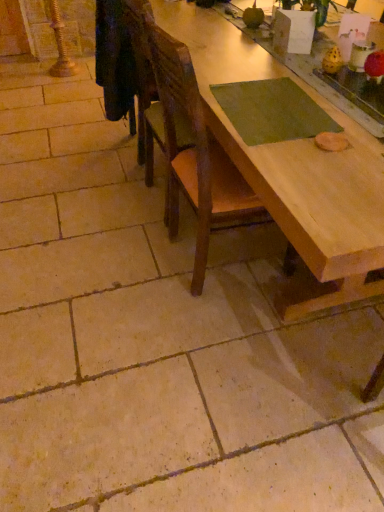
Question: Is the surface of wooden chair at center in direct contact with natural wood table at center?

Choices:
 (A) yes
 (B) no

Answer: (B)

Question: Could you tell me if wooden chair at center is turned towards natural wood table at center?

Choices:
 (A) no
 (B) yes

Answer: (B)

Question: From a real-world perspective, does wooden chair at center stand above natural wood table at center?

Choices:
 (A) yes
 (B) no

Answer: (A)

Question: Is wooden chair at center behind natural wood table at center?

Choices:
 (A) yes
 (B) no

Answer: (A)

Question: Can you confirm if wooden chair at center is taller than natural wood table at center?

Choices:
 (A) yes
 (B) no

Answer: (A)

Question: Is wooden chair at center bigger than natural wood table at center?

Choices:
 (A) yes
 (B) no

Answer: (B)

Question: Is natural wood table at center positioned with its back to wooden chair at center?

Choices:
 (A) yes
 (B) no

Answer: (B)

Question: Is natural wood table at center further to the viewer compared to wooden chair at center?

Choices:
 (A) no
 (B) yes

Answer: (A)

Question: Is natural wood table at center positioned beyond the bounds of wooden chair at center?

Choices:
 (A) no
 (B) yes

Answer: (B)

Question: Is natural wood table at center in front of wooden chair at center?

Choices:
 (A) no
 (B) yes

Answer: (B)

Question: Does natural wood table at center appear on the left side of wooden chair at center?

Choices:
 (A) yes
 (B) no

Answer: (B)

Question: Can you confirm if natural wood table at center is thinner than wooden chair at center?

Choices:
 (A) no
 (B) yes

Answer: (A)

Question: Relative to natural wood table at center, is wooden chair at center in front or behind?

Choices:
 (A) front
 (B) behind

Answer: (B)